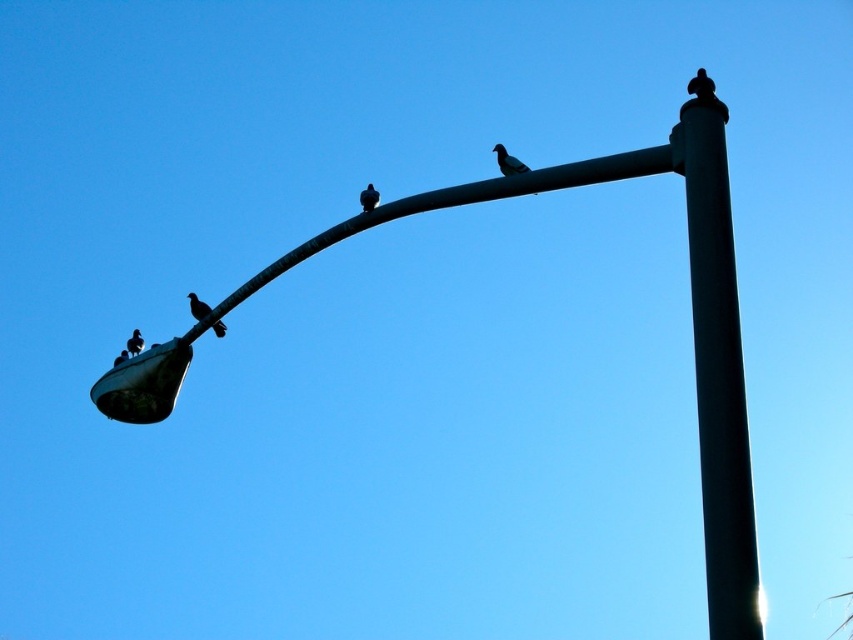
Between point (706, 196) and point (521, 163), which one is positioned in front?

Positioned in front is point (706, 196).

Between black metal pole at center-right and silvery metallic bird at upper center, which one is positioned lower?

black metal pole at center-right is lower down.

Image resolution: width=853 pixels, height=640 pixels. In order to click on black metal pole at center-right in this screenshot , I will do `click(718, 369)`.

You are a GUI agent. You are given a task and a screenshot of the screen. Output one action in this format:
    pyautogui.click(x=<x>, y=<y>)
    Task: Click on the black metal pole at center-right
    The width and height of the screenshot is (853, 640).
    Given the screenshot: What is the action you would take?
    pyautogui.click(x=718, y=369)

Can you confirm if black metal pole at center-right is positioned below silhouette feathered bird at lower left?

Indeed, black metal pole at center-right is positioned under silhouette feathered bird at lower left.

Who is higher up, black metal pole at center-right or silhouette feathered bird at lower left?

silhouette feathered bird at lower left

Between point (699, 387) and point (213, 333), which one is positioned in front?

Point (699, 387) is more forward.

Locate an element on the screen. black metal pole at center-right is located at coordinates (718, 369).

Between metallic pole at center and silvery metallic bird at left, which one is positioned lower?

silvery metallic bird at left

Which is in front, point (726, 438) or point (131, 349)?

Positioned in front is point (726, 438).

This screenshot has height=640, width=853. I want to click on metallic pole at center, so click(692, 326).